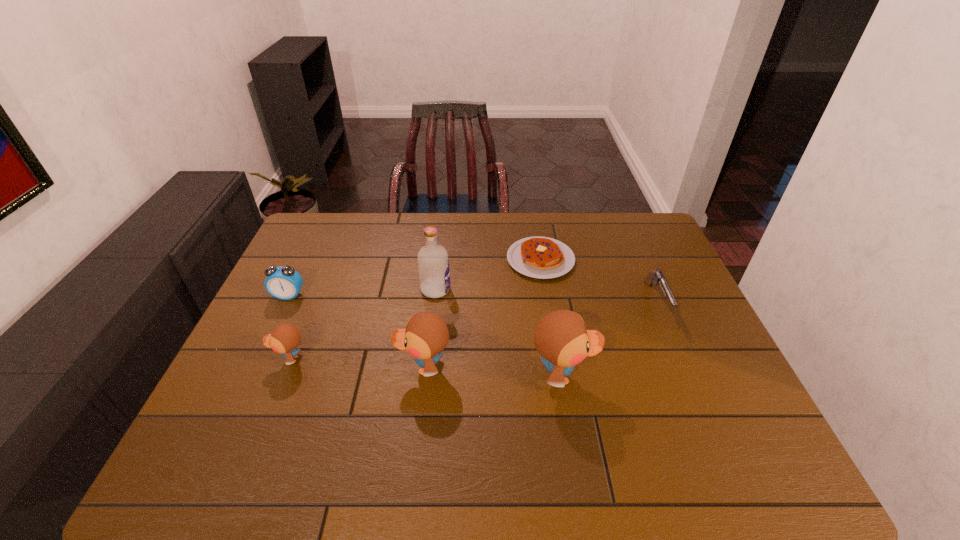
This screenshot has height=540, width=960. Find the location of `free space located on the front-facing side of the second duck from right to left`. free space located on the front-facing side of the second duck from right to left is located at coordinates (264, 367).

Locate an element on the screen. The image size is (960, 540). vacant region located on the front-facing side of the second duck from right to left is located at coordinates [x=299, y=367].

The height and width of the screenshot is (540, 960). In order to click on vacant space situated on the front-facing side of the rightmost duck in this screenshot , I will do `click(614, 376)`.

Where is `vacant space located on the label of the vodka`? vacant space located on the label of the vodka is located at coordinates (467, 290).

The width and height of the screenshot is (960, 540). Identify the location of vacant area situated on the front of the pancake. (558, 364).

Find the location of a particular element. Image resolution: width=960 pixels, height=540 pixels. free space located 0.160m aiming along the barrel of the gun is located at coordinates (687, 372).

At what (x,y) coordinates should I click in order to perform the action: click on free spot located on the face of the alarm clock. Please return your answer as a coordinate pair (x, y). Looking at the image, I should click on (249, 379).

At what (x,y) coordinates should I click in order to perform the action: click on object situated at the far edge. Please return your answer as a coordinate pair (x, y). The image size is (960, 540). Looking at the image, I should click on (540, 257).

At what (x,y) coordinates should I click in order to perform the action: click on duck situated at the left edge. Please return your answer as a coordinate pair (x, y). This screenshot has width=960, height=540. Looking at the image, I should click on (285, 338).

Where is `alarm clock that is positioned at the left edge`? alarm clock that is positioned at the left edge is located at coordinates (283, 282).